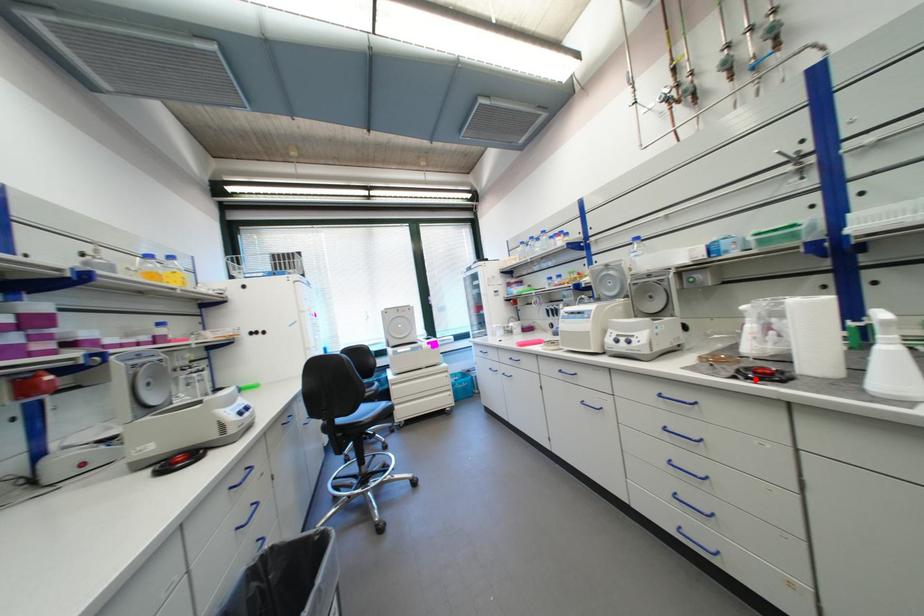
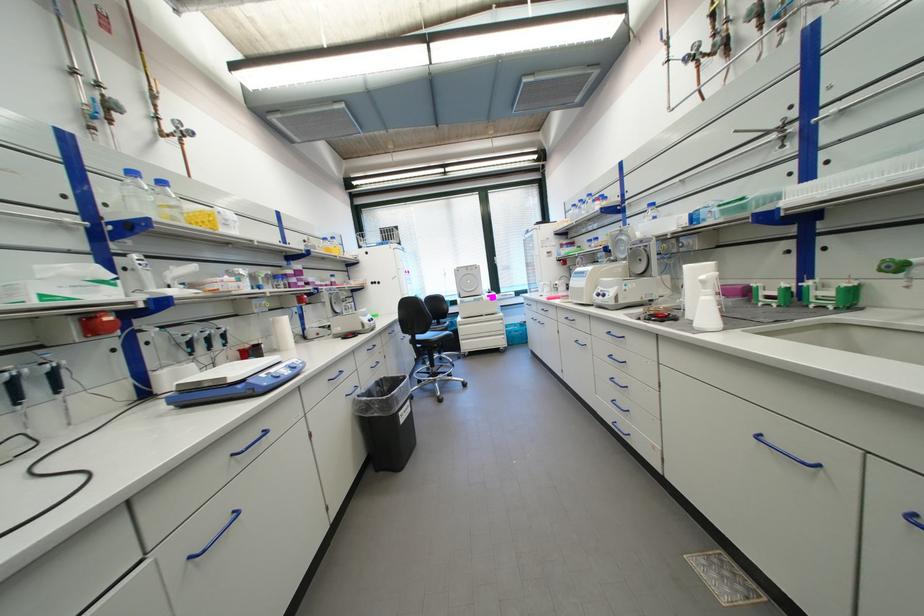
In the second image, find the point that corresponds to the highlighted location in the first image.

(655, 321)